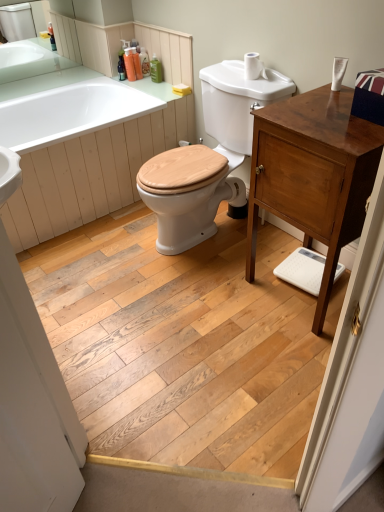
Identify the location of free point below white glossy sink at upper center, which ranks as the second sink in top-to-bottom order (from a real-world perspective). (220, 237).